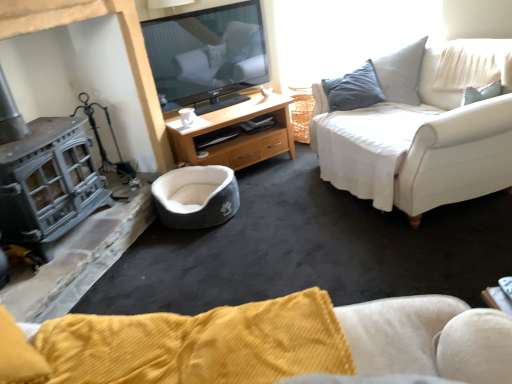
Locate an element on the screen. This screenshot has width=512, height=384. free space between white fabric couch at right and gray plush pet bed at center is located at coordinates (298, 213).